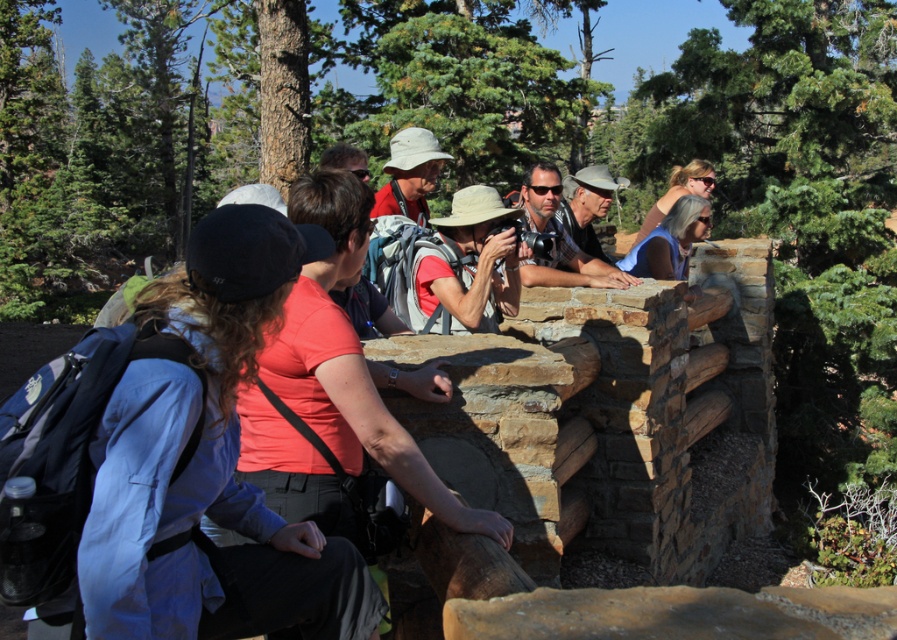
Question: Which of the following is the closest to the observer?

Choices:
 (A) coord(443,298)
 (B) coord(299,248)

Answer: (B)

Question: Where is matte white hat at center located in relation to matte gray hat at center in the image?

Choices:
 (A) above
 (B) below

Answer: (B)

Question: Which point is closer to the camera taking this photo?

Choices:
 (A) (538, 177)
 (B) (585, 216)
 (C) (623, 259)
 (D) (208, 481)

Answer: (D)

Question: Does matte red shirt at center have a greater width compared to matte white hat at center?

Choices:
 (A) no
 (B) yes

Answer: (B)

Question: Is matte white hat at center to the right of matte blue shirt at upper right from the viewer's perspective?

Choices:
 (A) yes
 (B) no

Answer: (B)

Question: Which point is closer to the camera?

Choices:
 (A) (684, 250)
 (B) (510, 273)
 (C) (619, 284)

Answer: (B)